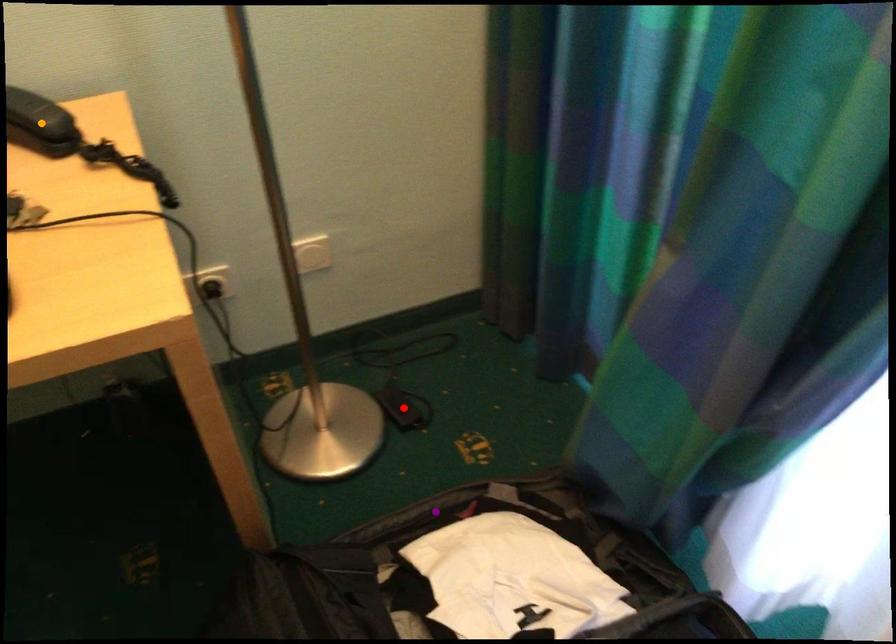
Order these from farthest to nearest:
1. orange point
2. purple point
3. red point

red point → purple point → orange point